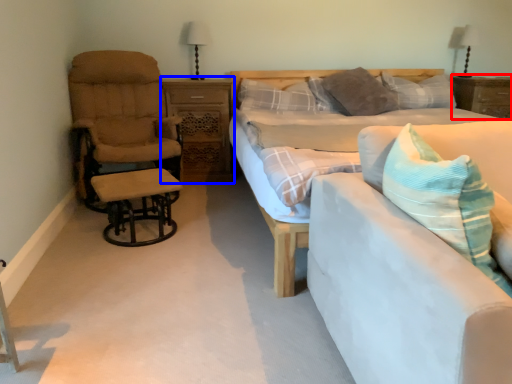
Question: Which object appears farthest to the camera in this image, nightstand (highlighted by a red box) or nightstand (highlighted by a blue box)?

Choices:
 (A) nightstand
 (B) nightstand

Answer: (A)